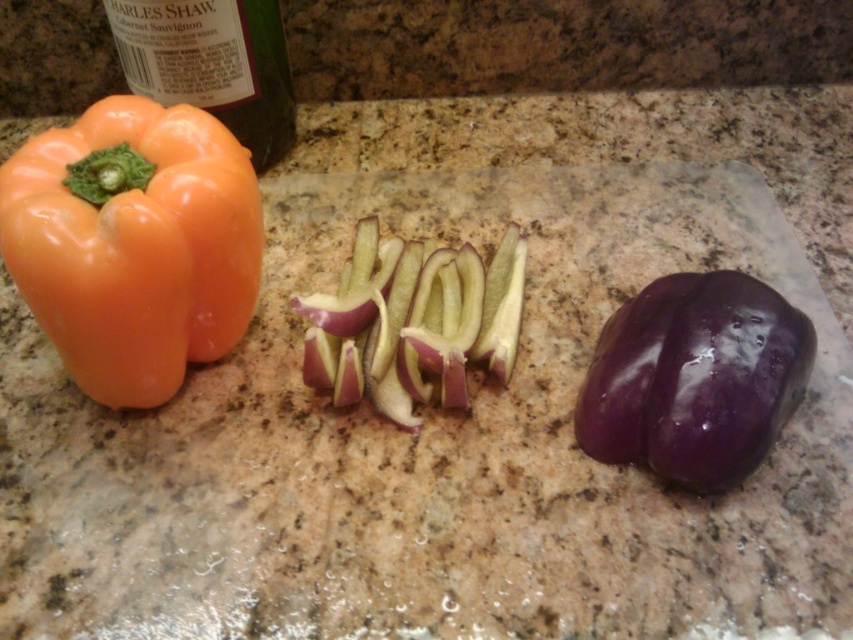
Question: Where is glossy purple bell pepper at right located in relation to green matte bottle at upper left in the image?

Choices:
 (A) above
 (B) below

Answer: (B)

Question: Does orange glossy bell pepper at left appear on the right side of glossy purple bell pepper at right?

Choices:
 (A) yes
 (B) no

Answer: (B)

Question: Which of the following is the farthest from the observer?

Choices:
 (A) (366, 221)
 (B) (212, 108)
 (C) (770, 349)

Answer: (B)

Question: Which point is farther to the camera?

Choices:
 (A) orange glossy bell pepper at left
 (B) green matte bottle at upper left

Answer: (B)

Question: Does orange glossy bell pepper at left appear on the left side of glossy purple bell pepper at right?

Choices:
 (A) yes
 (B) no

Answer: (A)

Question: Which of the following is the closest to the observer?

Choices:
 (A) (221, 184)
 (B) (422, 401)

Answer: (A)